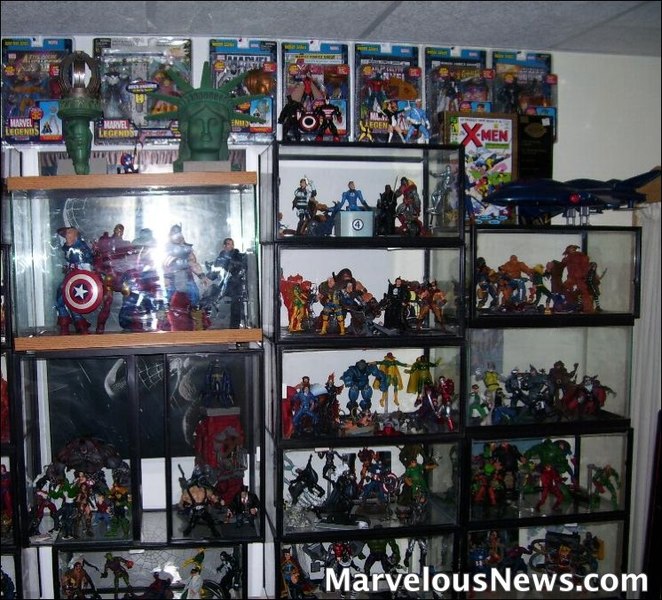
Find the location of a particular element. The image size is (662, 600). grey separations between ceiling panels is located at coordinates (387, 14), (608, 18).